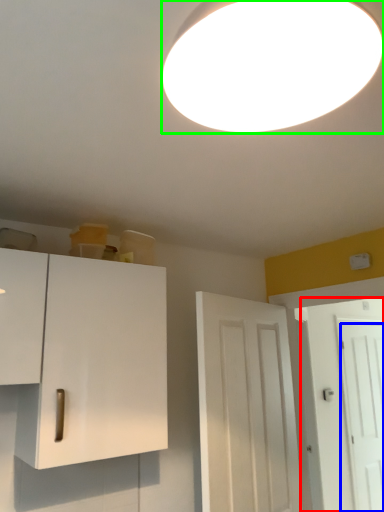
Question: Estimate the real-world distances between objects in this image. Which object is farther from door (highlighted by a red box), door (highlighted by a blue box) or lamp (highlighted by a green box)?

Choices:
 (A) door
 (B) lamp

Answer: (B)